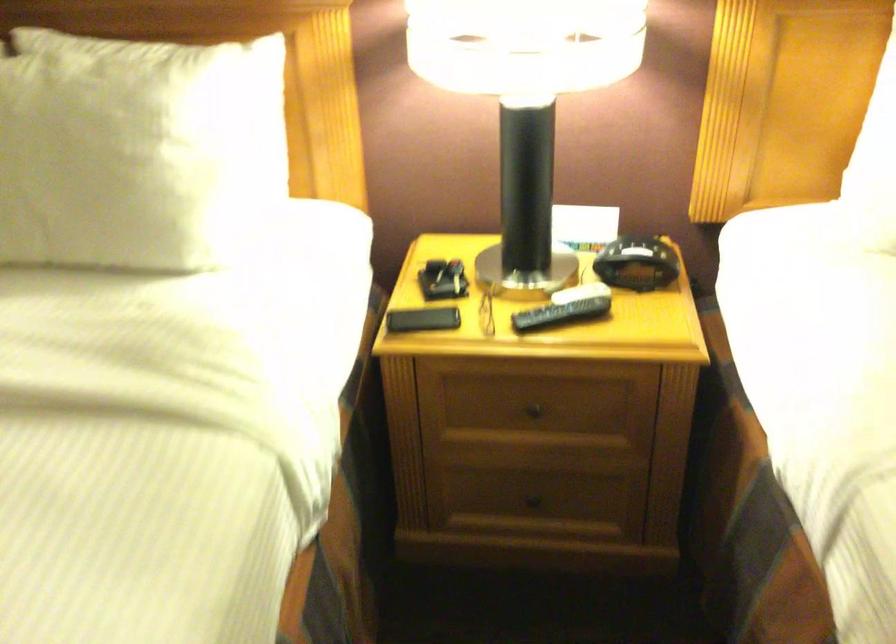
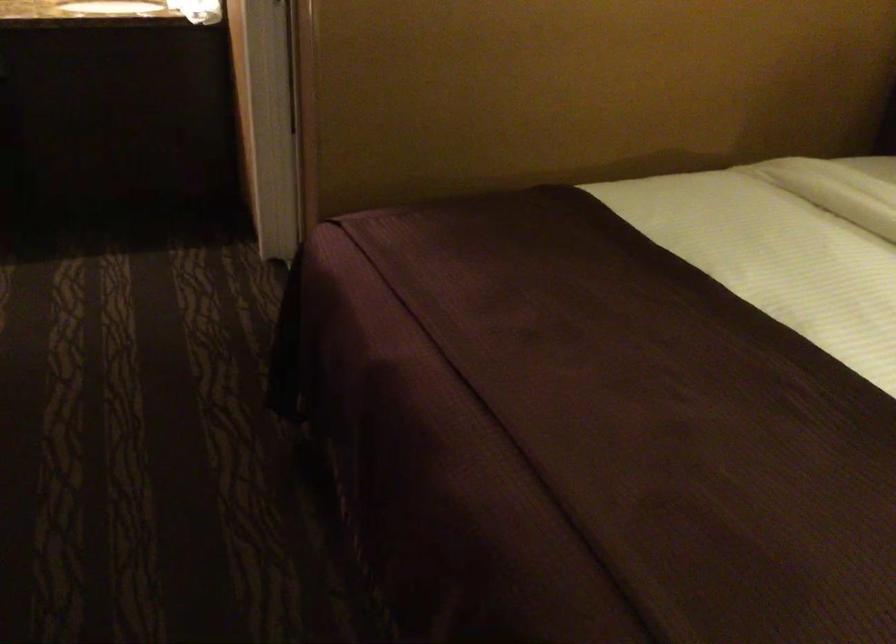
Question: Based on the continuous images, in which direction is the camera rotating? Reply with the corresponding letter.

Choices:
 (A) Left
 (B) Right
 (C) Up
 (D) Down

Answer: (A)